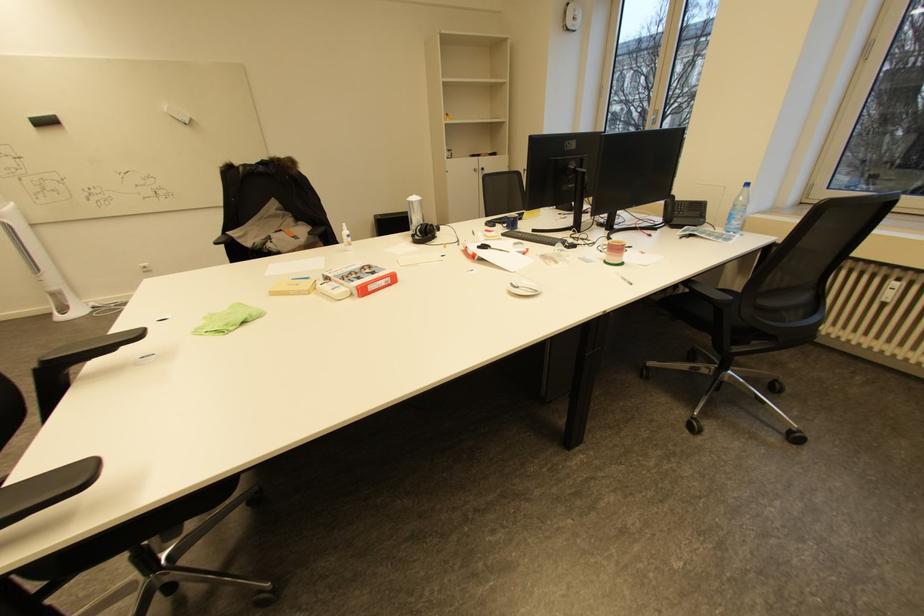
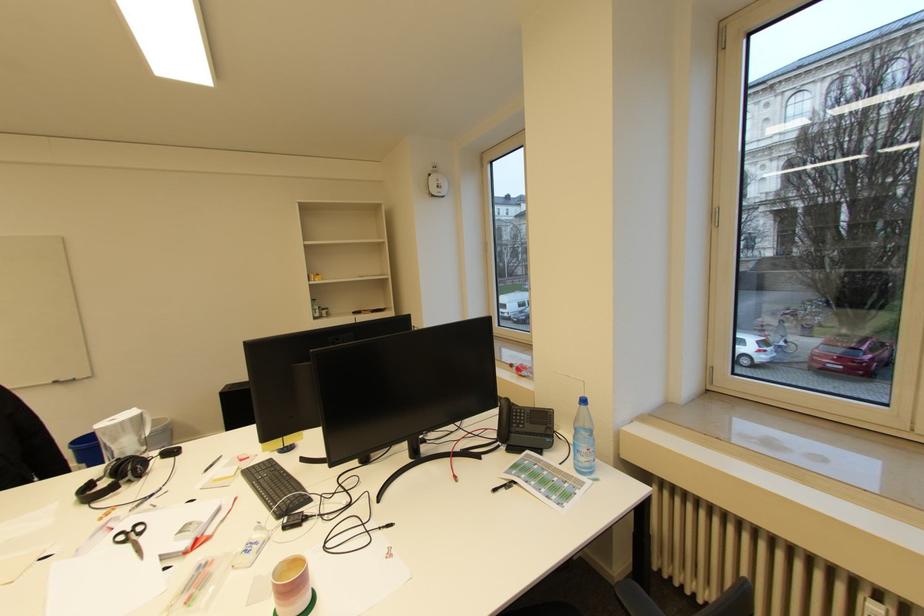
The point at (687,208) is marked in the first image. Where is the corresponding point in the second image?

(527, 416)